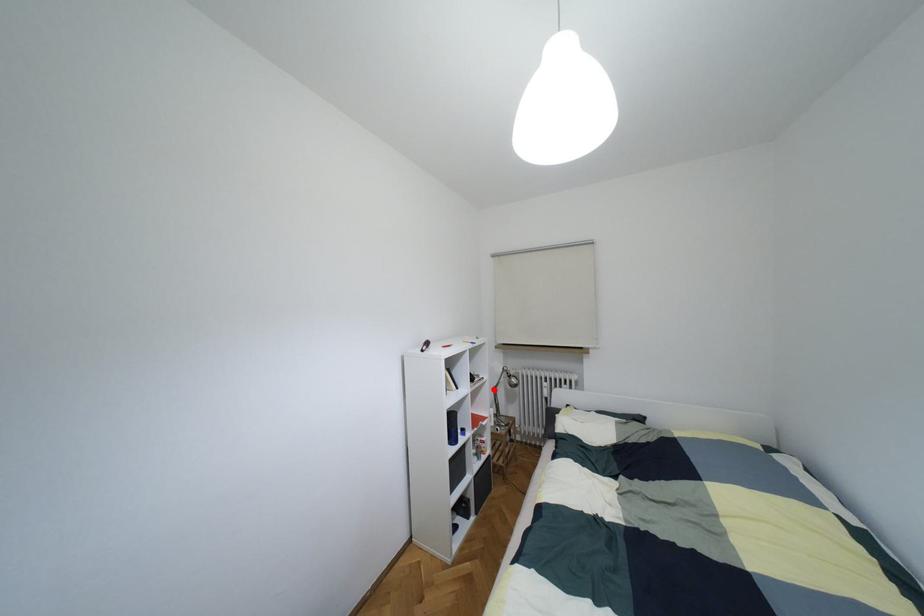
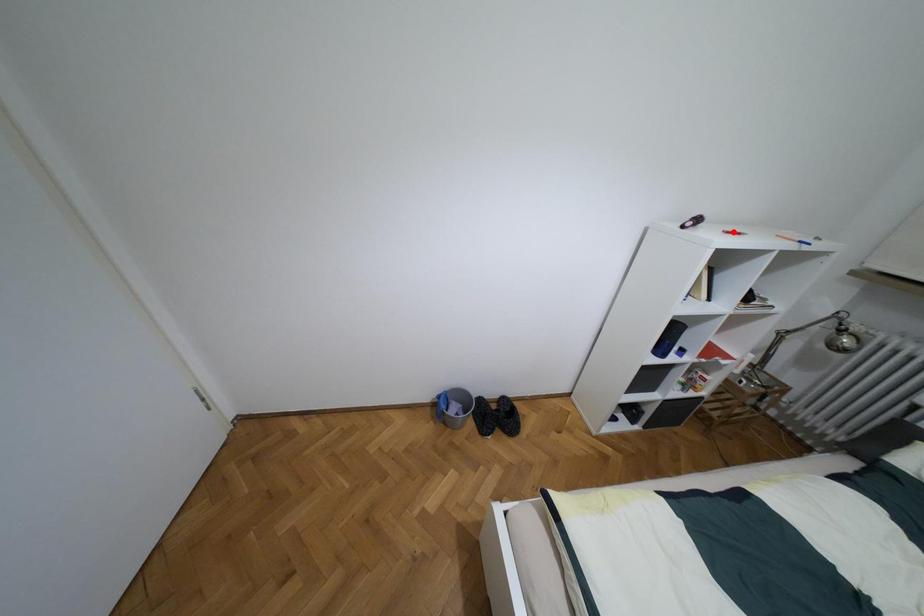
I am providing you with two images of the same scene from different viewpoints. A red point is marked on the first image and another point is marked on the second image. Are the points marked in image1 and image2 representing the same 3D position?

No